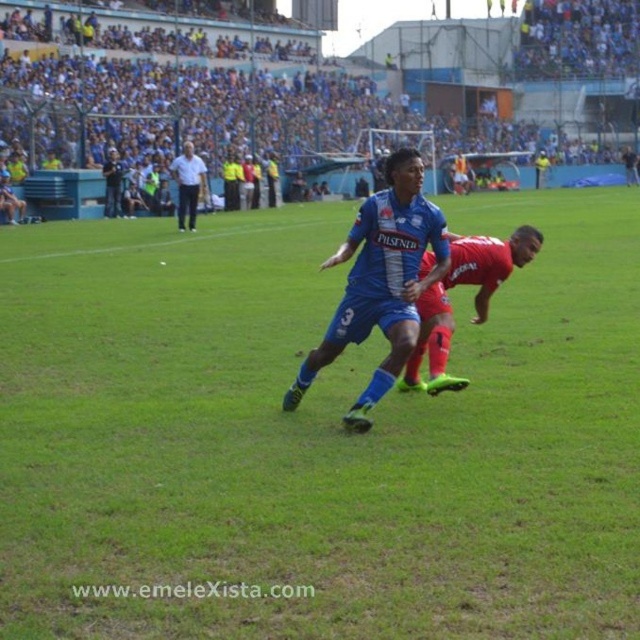
Between blue fabric soccer player at center and white cotton shirt at upper center, which one appears on the left side from the viewer's perspective?

Positioned to the left is white cotton shirt at upper center.

Is blue fabric soccer player at center smaller than white cotton shirt at upper center?

No, blue fabric soccer player at center is not smaller than white cotton shirt at upper center.

Does point (269, 637) come behind point (196, 156)?

No, it is not.

At what (x,y) coordinates should I click in order to perform the action: click on blue fabric soccer player at center. Please return your answer as a coordinate pair (x, y). Looking at the image, I should click on (314, 436).

Can you confirm if blue fabric soccer player at center is smaller than shiny red shorts at center?

Actually, blue fabric soccer player at center might be larger than shiny red shorts at center.

Which is above, blue fabric soccer player at center or shiny red shorts at center?

blue fabric soccer player at center is higher up.

This screenshot has width=640, height=640. Describe the element at coordinates (314, 436) in the screenshot. I see `blue fabric soccer player at center` at that location.

At what (x,y) coordinates should I click in order to perform the action: click on blue fabric soccer player at center. Please return your answer as a coordinate pair (x, y). Looking at the image, I should click on (314, 436).

Is blue jersey at center positioned at the back of shiny red shorts at center?

No, it is in front of shiny red shorts at center.

Between blue jersey at center and shiny red shorts at center, which one has more height?

With more height is blue jersey at center.

Where is `blue jersey at center`? blue jersey at center is located at coordinates (380, 282).